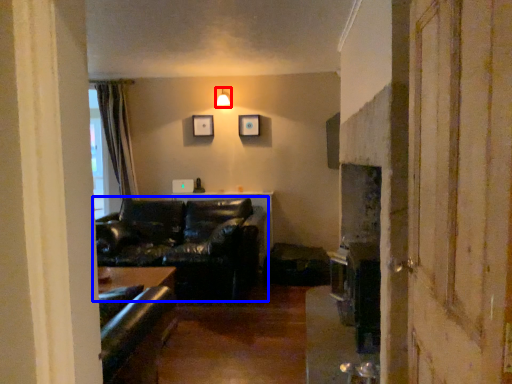
Question: Which of the following is the closest to the observer, light fixture (highlighted by a red box) or studio couch (highlighted by a blue box)?

Choices:
 (A) light fixture
 (B) studio couch

Answer: (B)